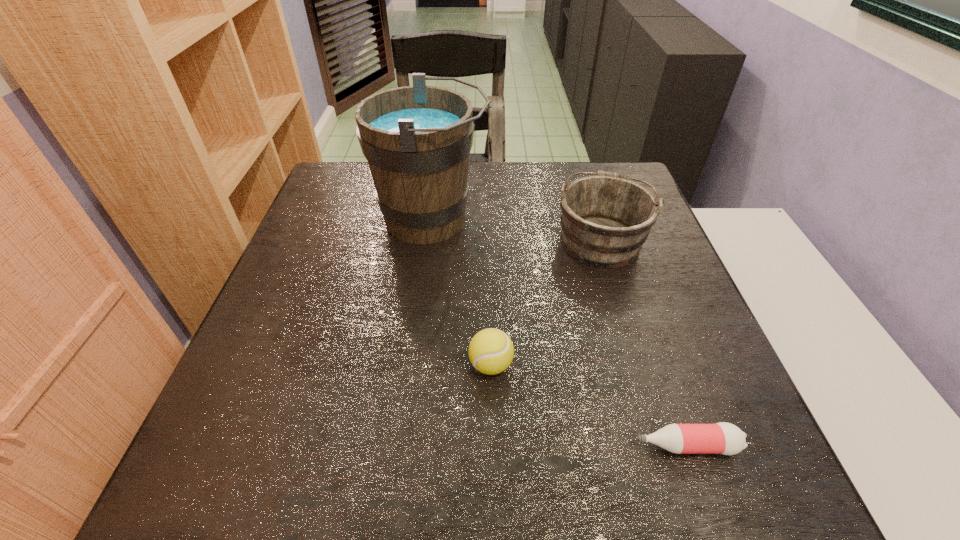
The height and width of the screenshot is (540, 960). In the image, there is a desktop. Identify the location of vacant space at the near edge. pyautogui.click(x=624, y=481).

In the image, there is a desktop. In order to click on vacant space at the left edge in this screenshot , I will do `click(308, 240)`.

Image resolution: width=960 pixels, height=540 pixels. Identify the location of vacant space at the right edge of the desktop. (689, 321).

The image size is (960, 540). Find the location of `free spot at the near right corner of the desktop`. free spot at the near right corner of the desktop is located at coordinates (742, 471).

Find the location of `free space between the second tallest object and the tallest object`. free space between the second tallest object and the tallest object is located at coordinates (516, 230).

This screenshot has height=540, width=960. I want to click on free space between the tallest object and the second nearest object, so click(462, 292).

This screenshot has height=540, width=960. I want to click on unoccupied area between the taller wine bucket and the shorter wine bucket, so click(x=516, y=230).

Locate an element on the screen. The width and height of the screenshot is (960, 540). free space between the second shortest object and the bottle is located at coordinates (588, 406).

You are a GUI agent. You are given a task and a screenshot of the screen. Output one action in this format:
    pyautogui.click(x=<x>, y=<y>)
    Task: Click on the free space between the nearest object and the taller wine bucket
    
    Given the screenshot: What is the action you would take?
    pyautogui.click(x=559, y=333)

The image size is (960, 540). Find the location of `vacant area that lies between the right wine bucket and the second nearest object`. vacant area that lies between the right wine bucket and the second nearest object is located at coordinates (545, 302).